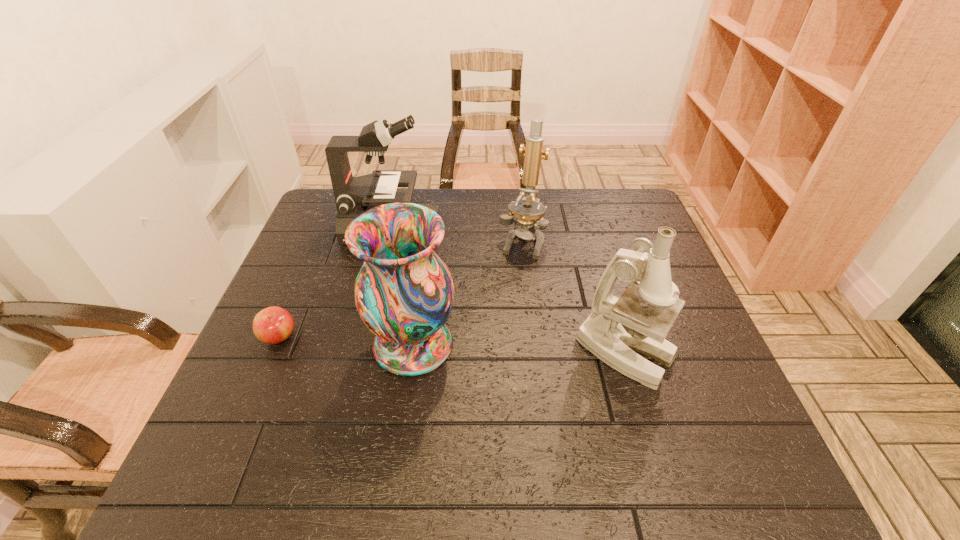
Point out which microscope is positioned as the nearest to the vase. Please provide its 2D coordinates. Your answer should be formatted as a tuple, i.e. [(x, y)], where the tuple contains the x and y coordinates of a point satisfying the conditions above.

[(529, 211)]

The width and height of the screenshot is (960, 540). Identify the location of microscope that is the closest one to the rightmost microscope. (529, 211).

You are a GUI agent. You are given a task and a screenshot of the screen. Output one action in this format:
    pyautogui.click(x=<x>, y=<y>)
    Task: Click on the vacant position in the image that satisfies the following two spatial constraints: 1. on the front side of the second microscope from left to right; 2. on the right side of the rightmost microscope
    
    Given the screenshot: What is the action you would take?
    pyautogui.click(x=535, y=353)

This screenshot has height=540, width=960. Identify the location of vacant space that satisfies the following two spatial constraints: 1. on the front side of the fourth object from left to right; 2. on the right side of the rightmost microscope. (535, 353).